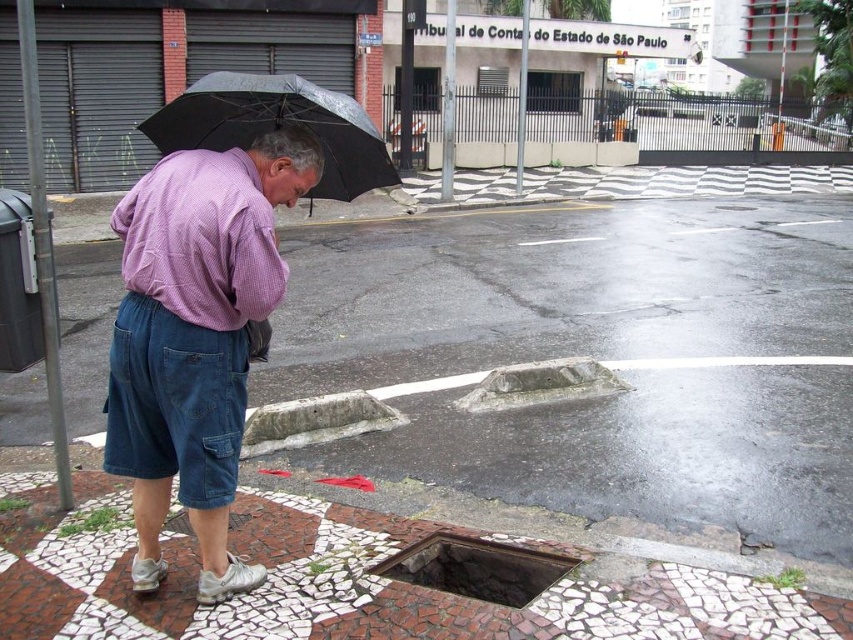
You are a delivery driver navigating through the rainy street. You need to avoid the white mosaic pavement at lower center to prevent slipping. According to the coordinates provided, where should you steer your vehicle to stay safe?

The white mosaic pavement at lower center is located at point (598, 356), so you should steer your vehicle away from that coordinate to avoid slipping.

You are a delivery person with a 1 meter long package. You need to place it between the purple woven shirt at center and the rusty metal manhole at lower center. Is there enough space?

The purple woven shirt at center is 96.90 centimeters from the rusty metal manhole at lower center. Since the package is 1 meter long, which is slightly longer than the distance between them, there isn